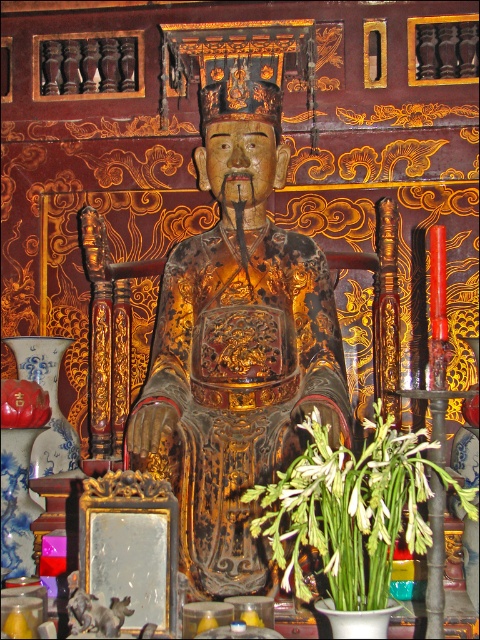
Is glossy wood statue at center to the left of matte red vase at lower left from the viewer's perspective?

Incorrect, glossy wood statue at center is not on the left side of matte red vase at lower left.

From the picture: Measure the distance from glossy wood statue at center to matte red vase at lower left.

glossy wood statue at center is 4.48 feet away from matte red vase at lower left.

Describe the element at coordinates (238, 344) in the screenshot. I see `glossy wood statue at center` at that location.

I want to click on glossy wood statue at center, so click(x=238, y=344).

Between green leafy plant at lower center and matte red vase at lower left, which one appears on the right side from the viewer's perspective?

From the viewer's perspective, green leafy plant at lower center appears more on the right side.

Find the location of a particular element. This screenshot has width=480, height=640. green leafy plant at lower center is located at coordinates (350, 509).

Between glossy wood statue at center and green leafy plant at lower center, which one is positioned lower?

green leafy plant at lower center

Locate an element on the screen. glossy wood statue at center is located at coordinates (238, 344).